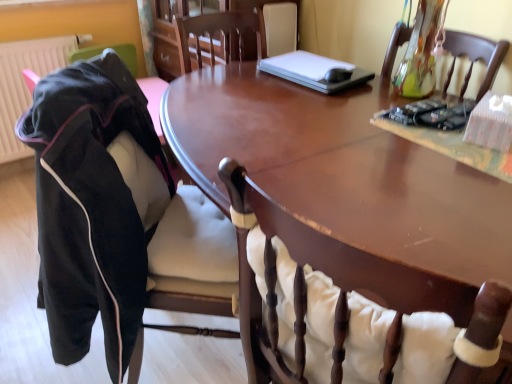
At what (x,y) coordinates should I click in order to perform the action: click on vacant region to the left of white plastic laptop at upper center. Please return your answer as a coordinate pair (x, y). The height and width of the screenshot is (384, 512). Looking at the image, I should click on (237, 79).